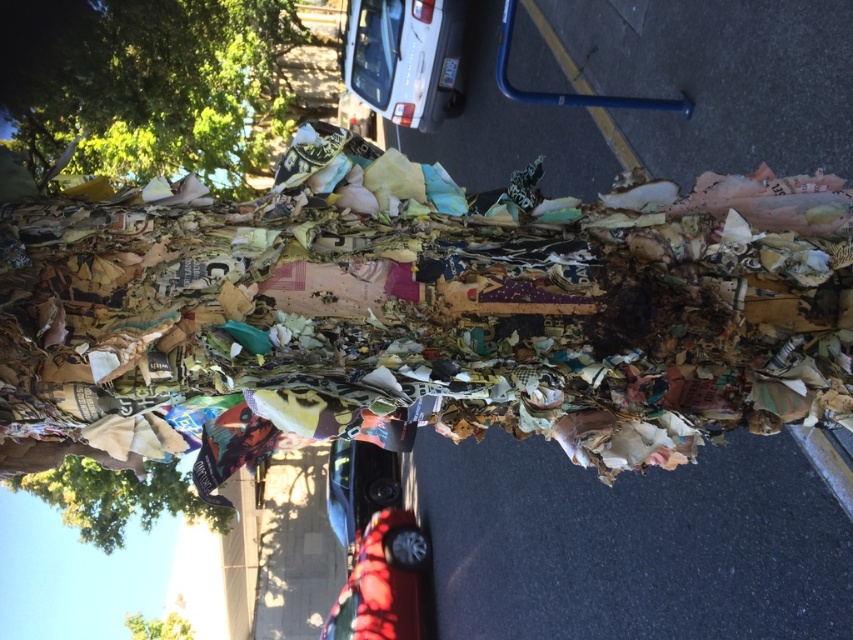
Question: Among these points, which one is nearest to the camera?

Choices:
 (A) (363, 508)
 (B) (141, 625)
 (C) (86, 467)
 (D) (267, 17)

Answer: (C)

Question: Which of these objects is positioned farthest from the shiny red car at center?

Choices:
 (A) white matte car at upper center
 (B) yellow paper tree at lower left
 (C) green leafy tree at upper left

Answer: (C)

Question: Is shiny red car at center further to the viewer compared to shiny black car at center?

Choices:
 (A) no
 (B) yes

Answer: (A)

Question: Does white matte car at upper center appear under brown paper tree at lower left?

Choices:
 (A) no
 (B) yes

Answer: (A)

Question: Where is shiny red car at center located in relation to shiny black car at center in the image?

Choices:
 (A) right
 (B) left

Answer: (A)

Question: Which of the following is the closest to the observer?

Choices:
 (A) (390, 465)
 (B) (183, 618)
 (C) (86, 163)

Answer: (C)